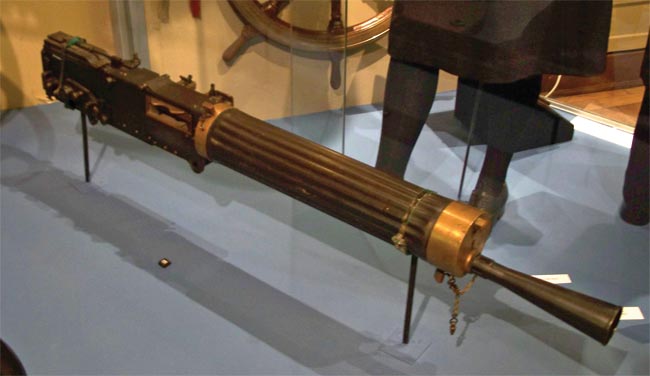
At what (x,y) coordinates should I click in order to perform the action: click on light blue floor. Please return your answer as a coordinate pair (x, y). The height and width of the screenshot is (376, 650). Looking at the image, I should click on (185, 276).